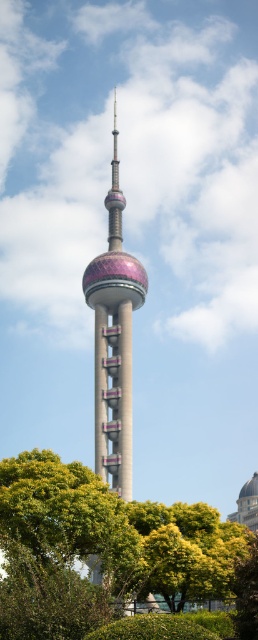
You are standing in front of the Oriental Pearl Tower and want to take a photo that includes both the green leafy tree at center and the green leafy tree at lower center. Which tree should you move closer to in order to have both trees appear larger in your photo?

To have both the green leafy tree at center and the green leafy tree at lower center appear larger in your photo, you should move closer to the green leafy tree at center since it is closer to the viewer and will allow both trees to be captured more prominently.

You are standing at the base of the Oriental Pearl Tower and want to reach the point marked at coordinates point (224,536). Given that the distance between you and the point is 108.29 meters, can you estimate how long it would take to walk there at a normal pace?

The distance between you and point (224,536) is 108.29 meters. At a normal walking pace of about 1.4 meters per second, it would take approximately 77 seconds, or roughly 1 minute and 17 seconds, to reach the point.